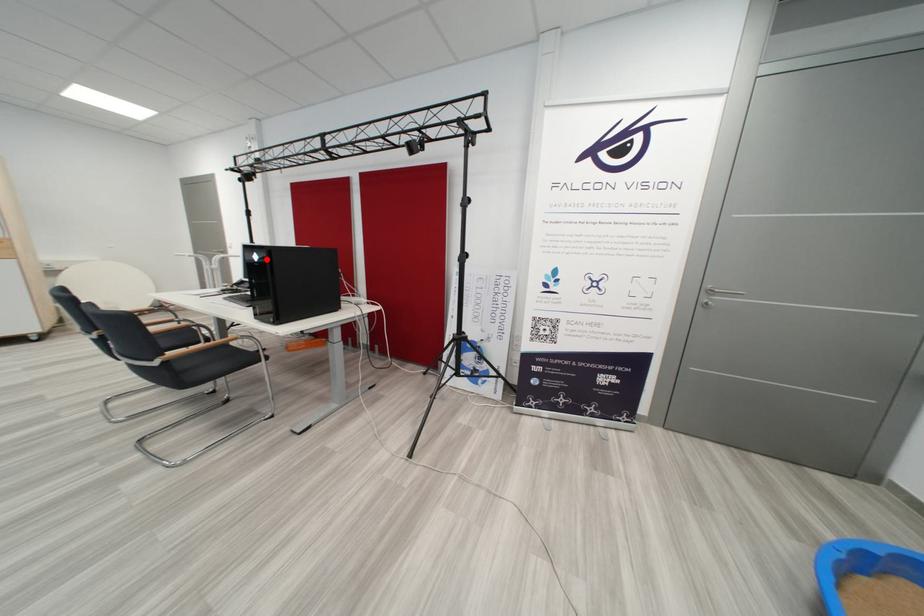
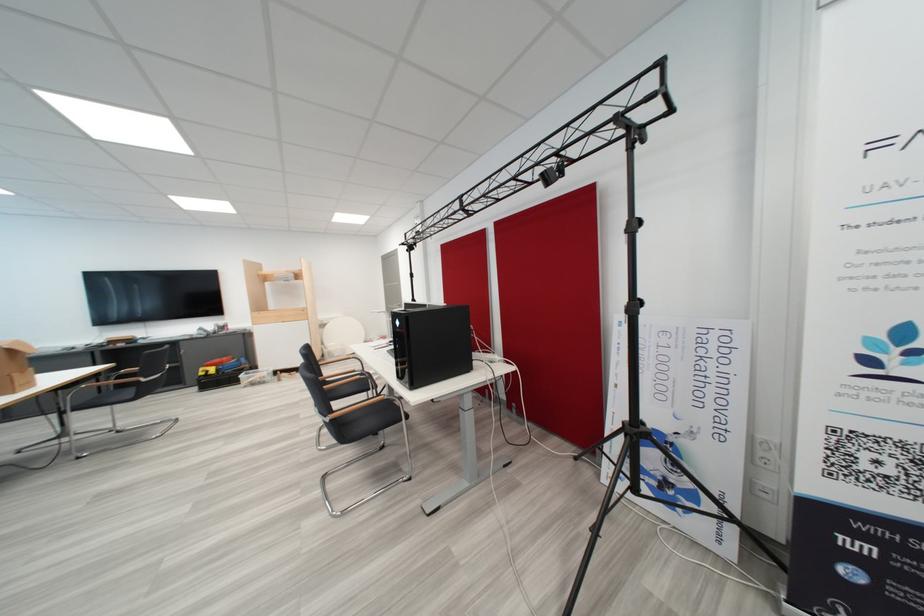
Question: I am providing you with two images of the same scene from different viewpoints. A red point is shown in image1. For the corresponding object point in image2, is it positioned nearer or farther from the camera?

Choices:
 (A) Nearer
 (B) Farther

Answer: (B)